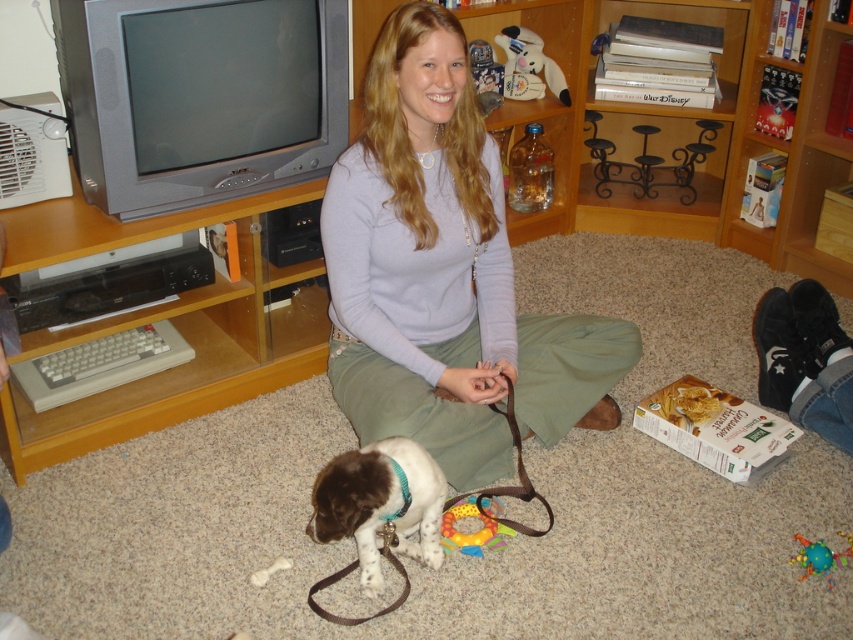
Is wooden entertainment center at lower left wider than white plush toy at upper center?

Yes, wooden entertainment center at lower left is wider than white plush toy at upper center.

At what (x,y) coordinates should I click in order to perform the action: click on wooden entertainment center at lower left. Please return your answer as a coordinate pair (x, y). This screenshot has width=853, height=640. Looking at the image, I should click on (161, 317).

Does point (221, 305) lie behind point (514, 92)?

No, it is not.

Find the location of a particular element. This screenshot has width=853, height=640. wooden entertainment center at lower left is located at coordinates (161, 317).

Does point (602, 198) lie behind point (500, 508)?

Yes, point (602, 198) is farther from viewer.

Find the location of `wooden bookshelf at upper center`. wooden bookshelf at upper center is located at coordinates (712, 116).

Locate an element on the screen. This screenshot has width=853, height=640. wooden bookshelf at upper center is located at coordinates (712, 116).

Describe the element at coordinates (444, 273) in the screenshot. I see `light purple sweater at center` at that location.

Between light purple sweater at center and rubber/plastic dog toy at lower center, which one appears on the right side from the viewer's perspective?

From the viewer's perspective, rubber/plastic dog toy at lower center appears more on the right side.

Locate an element on the screen. This screenshot has width=853, height=640. light purple sweater at center is located at coordinates (444, 273).